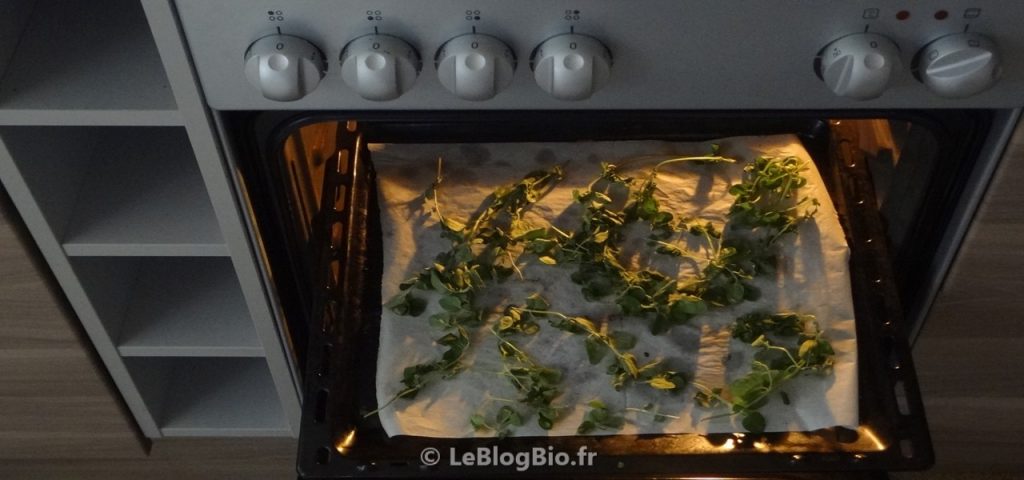
At what (x,y) coordinates should I click in order to perform the action: click on 3rd shelf. Please return your answer as a coordinate pair (x, y). Looking at the image, I should click on (143, 197).